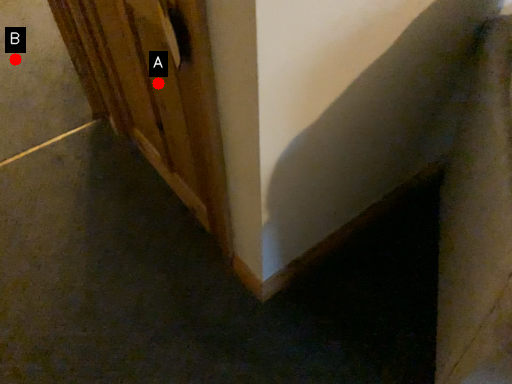
Question: Two points are circled on the image, labeled by A and B beside each circle. Which of the following is the farthest from the observer?

Choices:
 (A) A is further
 (B) B is further

Answer: (B)